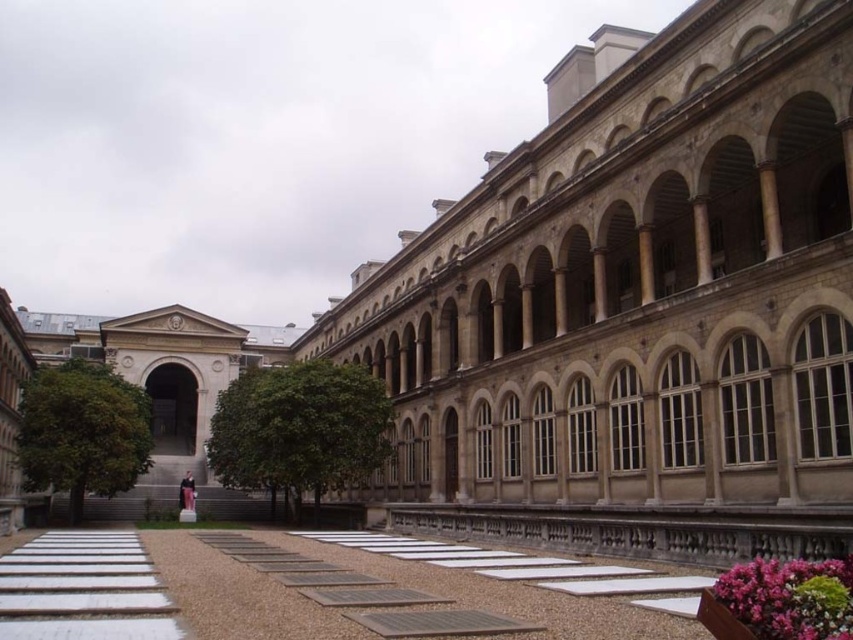
Does gray gravel at center have a lesser width compared to pink textured flowers at lower right?

No, gray gravel at center is not thinner than pink textured flowers at lower right.

The height and width of the screenshot is (640, 853). In order to click on gray gravel at center in this screenshot , I will do `click(379, 596)`.

Where is `gray gravel at center`? The width and height of the screenshot is (853, 640). gray gravel at center is located at coordinates (379, 596).

Is beige stone palace at center wider than pink textured flowers at lower right?

Correct, the width of beige stone palace at center exceeds that of pink textured flowers at lower right.

Does beige stone palace at center have a lesser height compared to pink textured flowers at lower right?

No, beige stone palace at center is not shorter than pink textured flowers at lower right.

Between point (549, 298) and point (838, 595), which one is positioned behind?

The point (549, 298) is behind.

Where is `beige stone palace at center`? beige stone palace at center is located at coordinates click(x=637, y=301).

Is point (587, 627) more distant than point (67, 611)?

No, (587, 627) is closer to viewer.

Who is positioned more to the left, gray gravel at center or white concrete path at lower left?

white concrete path at lower left is more to the left.

The width and height of the screenshot is (853, 640). Describe the element at coordinates (379, 596) in the screenshot. I see `gray gravel at center` at that location.

Where is `gray gravel at center`? Image resolution: width=853 pixels, height=640 pixels. gray gravel at center is located at coordinates (379, 596).